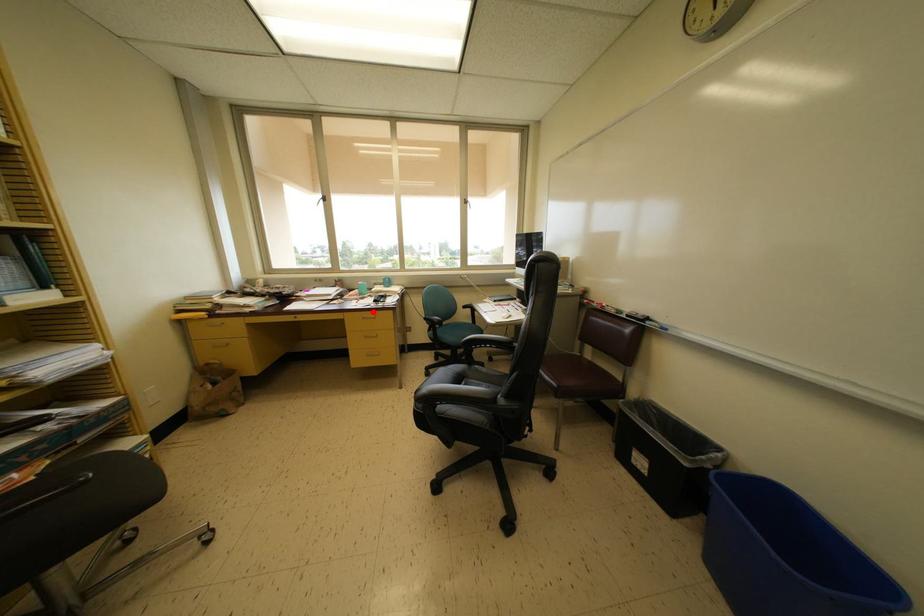
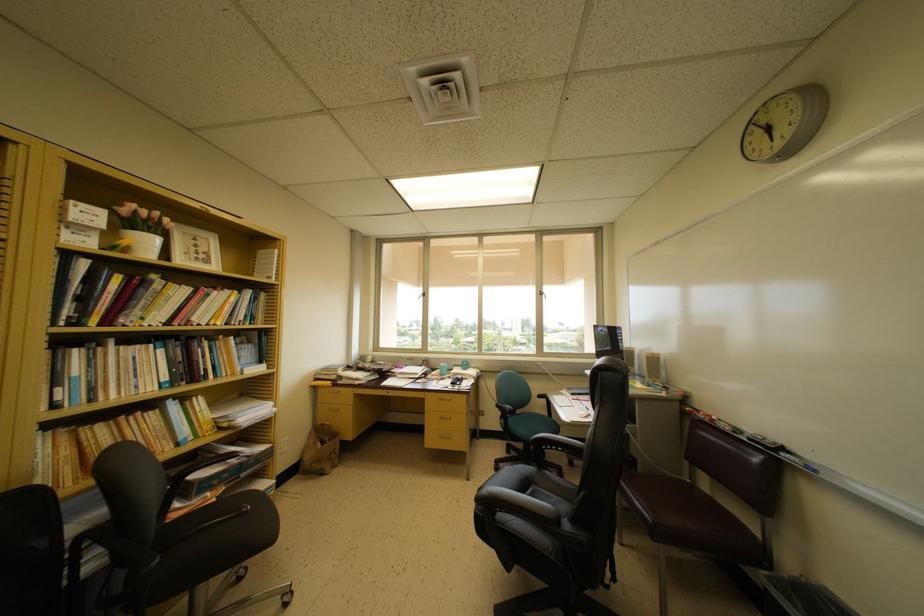
Question: I am providing you with two images of the same scene from different viewpoints. In image1, a red point is highlighted. Considering the same 3D point in image2, which of the following is correct?

Choices:
 (A) It is closer
 (B) It is farther

Answer: (B)